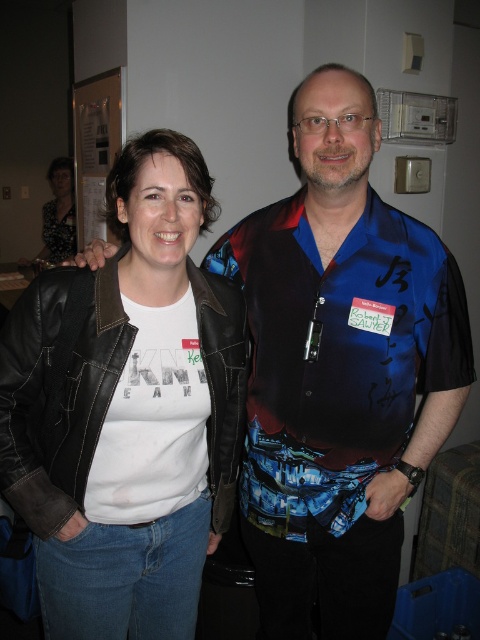
Based on the photo, does leather jacket at left have a smaller size compared to patterned fabric blouse at upper left?

Yes.

Is leather jacket at left to the right of patterned fabric blouse at upper left from the viewer's perspective?

Correct, you'll find leather jacket at left to the right of patterned fabric blouse at upper left.

Where is `leather jacket at left`? leather jacket at left is located at coordinates (128, 410).

You are a GUI agent. You are given a task and a screenshot of the screen. Output one action in this format:
    pyautogui.click(x=<x>, y=<y>)
    Task: Click on the leather jacket at left
    Image resolution: width=480 pixels, height=640 pixels.
    Given the screenshot: What is the action you would take?
    pyautogui.click(x=128, y=410)